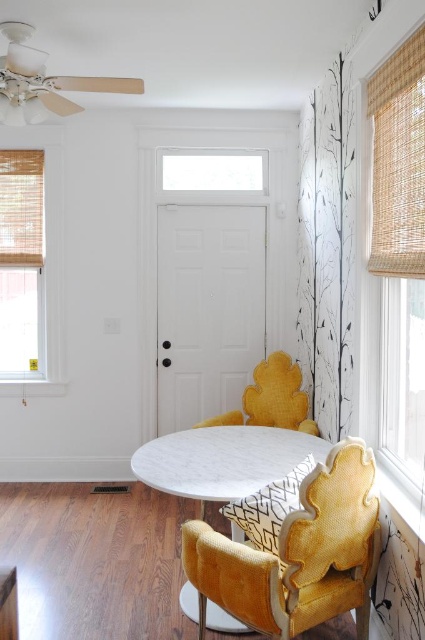
Question: Is woven bamboo shade at right bigger than bamboo blind at left?

Choices:
 (A) yes
 (B) no

Answer: (A)

Question: Among these objects, which one is farthest from the camera?

Choices:
 (A) velvet yellow chair at center
 (B) velvet yellow armchair at center
 (C) woven bamboo shade at right

Answer: (A)

Question: Which is farther from the velvet yellow armchair at center?

Choices:
 (A) bamboo blind at left
 (B) woven bamboo shade at right
 (C) velvet yellow chair at center

Answer: (A)

Question: Is velvet yellow armchair at center closer to the viewer compared to velvet yellow chair at center?

Choices:
 (A) yes
 (B) no

Answer: (A)

Question: Which object is closer to the camera taking this photo?

Choices:
 (A) woven bamboo shade at right
 (B) velvet yellow chair at center
 (C) bamboo blind at left
 (D) velvet yellow armchair at center

Answer: (A)

Question: Is bamboo blind at left wider than velvet yellow chair at center?

Choices:
 (A) yes
 (B) no

Answer: (B)